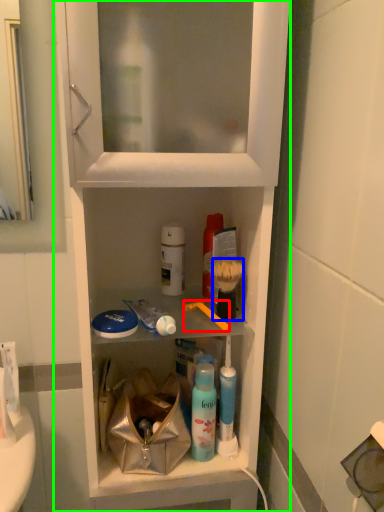
Question: Which is farther away from toothbrush (highlighted by a red box)? brush (highlighted by a blue box) or cabinetry (highlighted by a green box)?

Choices:
 (A) brush
 (B) cabinetry

Answer: (B)